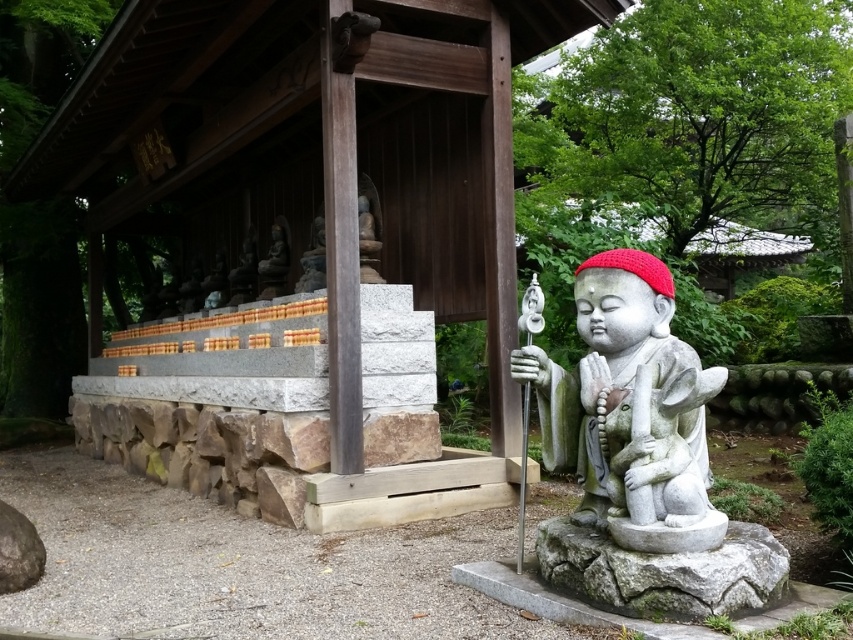
You are a visitor in the garden and want to take a photo of both the white stone statue at center and the gray stone statue at lower right. Which statue should you focus on first to ensure both are in frame without moving the camera?

You should focus on the white stone statue at center first because it is taller than the gray stone statue at lower right, so it will occupy more space in the photo and help frame both statues properly.

You are standing in the Japanese garden and want to take a photo of both the stone statue and the wooden pavilion. The statue is located at point (660, 339) and the pavilion is at point (744, 604). Since you can only focus on one point at a time, which point should you focus on to ensure both subjects are in the frame?

You should focus on point (660, 339) because it is closer to the camera than point (744, 604). By focusing on the closer point, the statue will be in focus, and the pavilion, being further away, might still be within the depth of field, ensuring both are visible in the photo.

You are planning to place a new decorative item in the Japanese garden scene. The new item is 1.2 meters wide. You have two options for placement areas based on existing statues. The first option is next to the white stone statue at center, and the second is next to the gray stone statue at lower right. Which placement area has enough space for the new item?

The gray stone statue at lower right has a greater width than the white stone statue at center. Since the new item is 1.2 meters wide, the placement area next to the gray stone statue at lower right likely has more space to accommodate it.